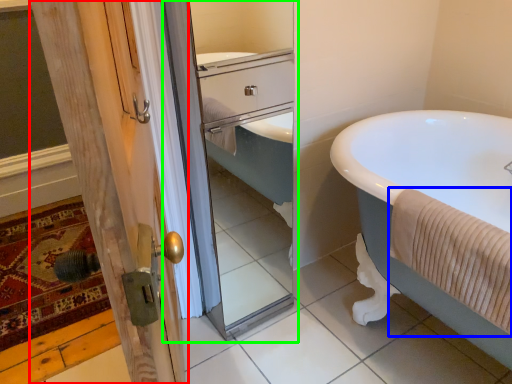
Question: Considering the real-world distances, which object is farthest from door (highlighted by a red box)? bath towel (highlighted by a blue box) or screen door (highlighted by a green box)?

Choices:
 (A) bath towel
 (B) screen door

Answer: (A)